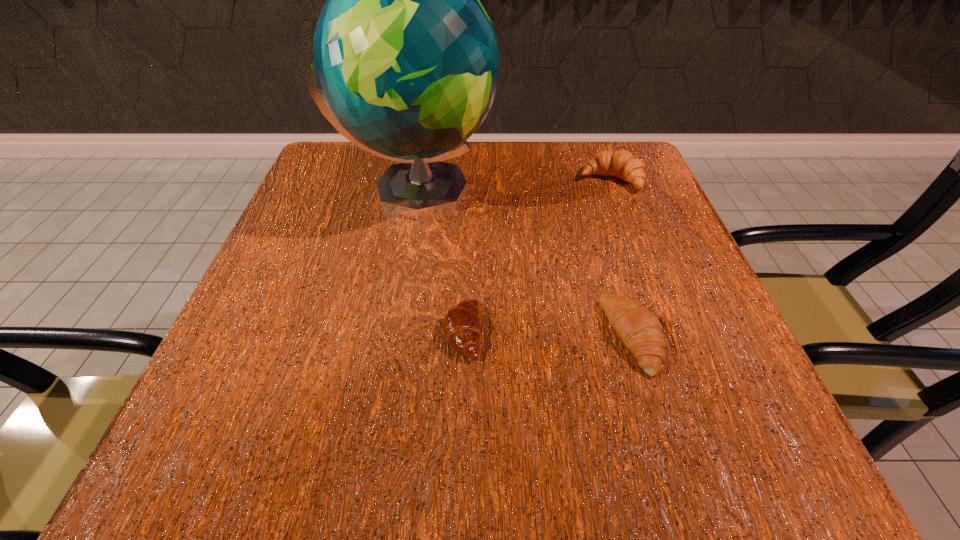
You are a GUI agent. You are given a task and a screenshot of the screen. Output one action in this format:
    pyautogui.click(x=<x>, y=<y>)
    Task: Click on the globe
    The height and width of the screenshot is (540, 960).
    Given the screenshot: What is the action you would take?
    pyautogui.click(x=406, y=64)

You are a GUI agent. You are given a task and a screenshot of the screen. Output one action in this format:
    pyautogui.click(x=<x>, y=<y>)
    Task: Click on the farthest crescent roll
    
    Given the screenshot: What is the action you would take?
    pyautogui.click(x=622, y=164)

Where is `the third shortest object`? The width and height of the screenshot is (960, 540). the third shortest object is located at coordinates (622, 164).

Where is `the second tallest crescent roll`? the second tallest crescent roll is located at coordinates (641, 331).

This screenshot has width=960, height=540. I want to click on the shortest crescent roll, so click(462, 327).

Where is `the leftmost crescent roll`? The image size is (960, 540). the leftmost crescent roll is located at coordinates (462, 327).

Where is `vacant space positioned 0.320m on the front surface of the globe`? The width and height of the screenshot is (960, 540). vacant space positioned 0.320m on the front surface of the globe is located at coordinates (652, 193).

You are a GUI agent. You are given a task and a screenshot of the screen. Output one action in this format:
    pyautogui.click(x=<x>, y=<y>)
    Task: Click on the free point located on the left of the third shortest object
    
    Given the screenshot: What is the action you would take?
    pyautogui.click(x=522, y=180)

Where is `vacant region located 0.090m on the front of the third tallest object`? The image size is (960, 540). vacant region located 0.090m on the front of the third tallest object is located at coordinates (669, 444).

Where is `free region located on the left of the leftmost crescent roll`? free region located on the left of the leftmost crescent roll is located at coordinates (403, 333).